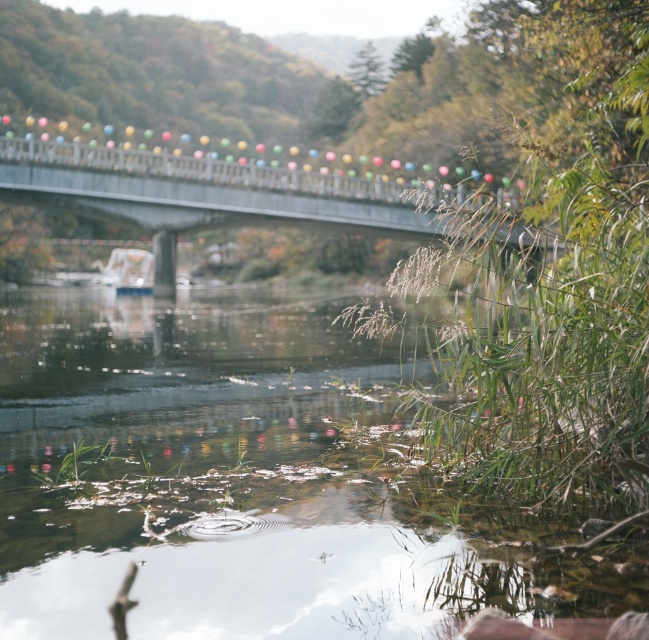
Who is more distant from viewer, (47, 193) or (103, 276)?

Positioned behind is point (103, 276).

Measure the distance between concrete bridge at center and camera.

4.34 meters

Locate an element on the screen. The image size is (649, 640). concrete bridge at center is located at coordinates (210, 195).

Between translucent water at lower center and white plastic boat at center, which one has more height?

With more height is white plastic boat at center.

Is point (217, 493) positioned after point (141, 285)?

That is False.

Locate an element on the screen. translucent water at lower center is located at coordinates (251, 483).

Can you confirm if translucent water at lower center is taller than concrete bridge at center?

No.

Does translucent water at lower center have a smaller size compared to concrete bridge at center?

Yes.

What do you see at coordinates (251, 483) in the screenshot? This screenshot has width=649, height=640. I see `translucent water at lower center` at bounding box center [251, 483].

Where is `translucent water at lower center`? The width and height of the screenshot is (649, 640). translucent water at lower center is located at coordinates (251, 483).